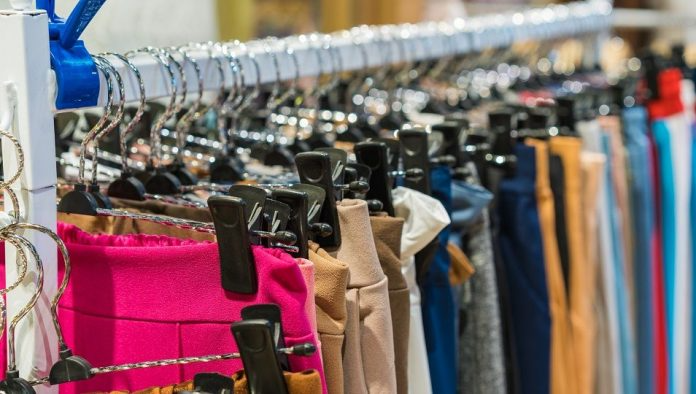
The width and height of the screenshot is (696, 394). In order to click on white wall in this screenshot , I will do `click(143, 25)`.